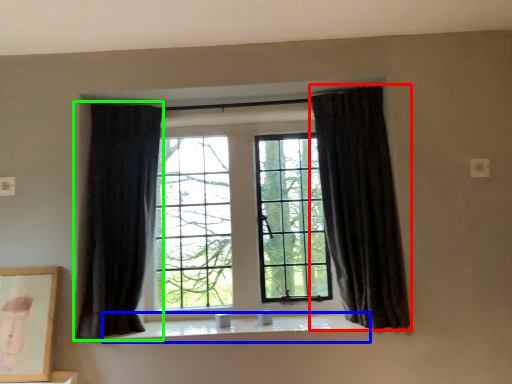
Question: Which is farther away from curtain (highlighted by a red box)? window sill (highlighted by a blue box) or curtain (highlighted by a green box)?

Choices:
 (A) window sill
 (B) curtain

Answer: (B)